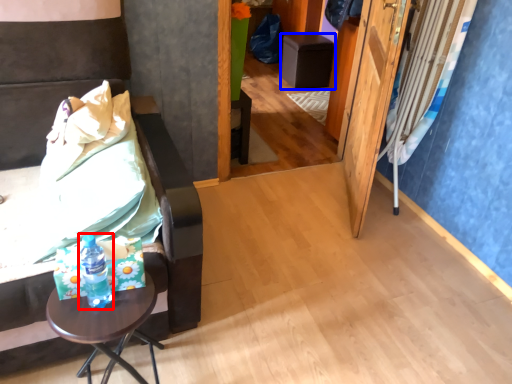
Question: Which point is closer to the camera, bottle (highlighted by a red box) or furniture (highlighted by a blue box)?

Choices:
 (A) bottle
 (B) furniture

Answer: (A)